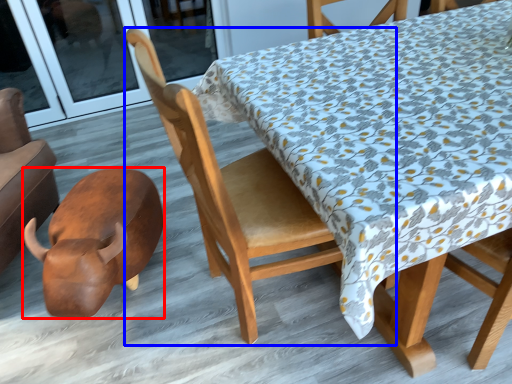
Question: Which point is further to the camera, animal (highlighted by a red box) or chair (highlighted by a blue box)?

Choices:
 (A) animal
 (B) chair

Answer: (A)